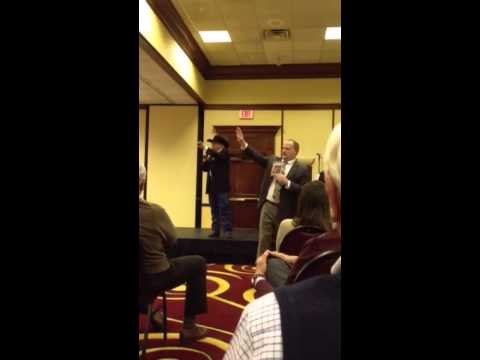
Identify the location of walls. pos(186,149), pos(317,120).